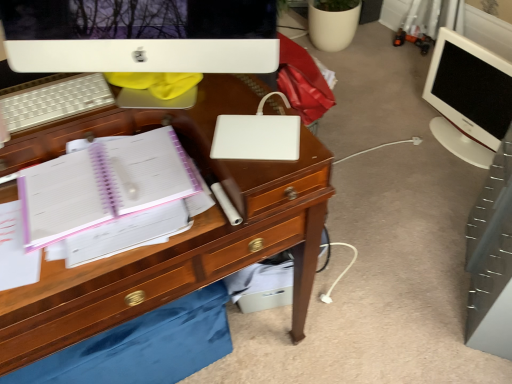
Where is `free spot above pink glossy notebook at left (from a real-world perspective)`? free spot above pink glossy notebook at left (from a real-world perspective) is located at coordinates (100, 180).